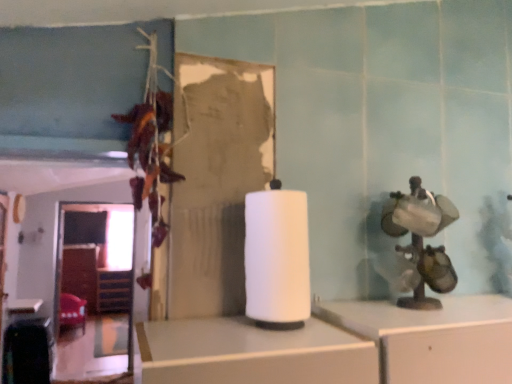
Question: Considering the relative positions of white glossy table at lower left and velvet red chair at lower left in the image provided, is white glossy table at lower left in front of velvet red chair at lower left?

Choices:
 (A) yes
 (B) no

Answer: (A)

Question: Is velvet red chair at lower left at the back of white glossy table at lower left?

Choices:
 (A) yes
 (B) no

Answer: (B)

Question: Can you confirm if white glossy table at lower left is taller than velvet red chair at lower left?

Choices:
 (A) no
 (B) yes

Answer: (A)

Question: Can you confirm if white glossy table at lower left is smaller than velvet red chair at lower left?

Choices:
 (A) no
 (B) yes

Answer: (B)

Question: Is white glossy table at lower left facing towards velvet red chair at lower left?

Choices:
 (A) yes
 (B) no

Answer: (B)

Question: Does white glossy table at lower left appear on the left side of velvet red chair at lower left?

Choices:
 (A) no
 (B) yes

Answer: (A)

Question: Can you confirm if white matte paper towel at center is positioned to the right of wooden at left?

Choices:
 (A) no
 (B) yes

Answer: (B)

Question: Does white matte paper towel at center appear on the left side of wooden at left?

Choices:
 (A) yes
 (B) no

Answer: (B)

Question: Is white matte paper towel at center bigger than wooden at left?

Choices:
 (A) yes
 (B) no

Answer: (B)

Question: Considering the relative sizes of white matte paper towel at center and wooden at left in the image provided, is white matte paper towel at center smaller than wooden at left?

Choices:
 (A) no
 (B) yes

Answer: (B)

Question: Is wooden at left surrounded by white matte paper towel at center?

Choices:
 (A) yes
 (B) no

Answer: (B)

Question: From a real-world perspective, is white matte paper towel at center below wooden at left?

Choices:
 (A) no
 (B) yes

Answer: (A)

Question: Is velvet red chair at lower left at the right side of white matte paper towel at center?

Choices:
 (A) yes
 (B) no

Answer: (B)